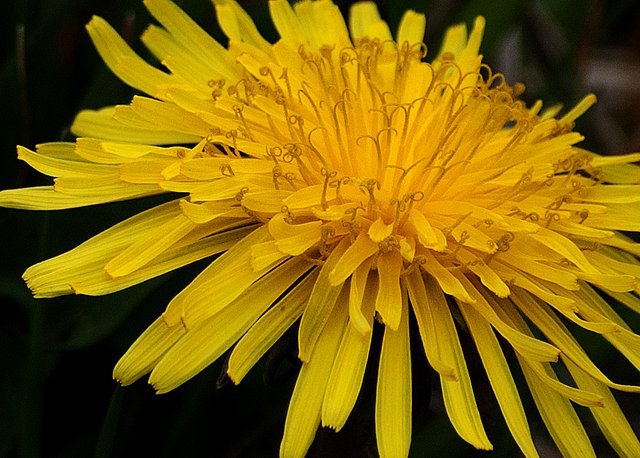
Find the location of a particular element. The image size is (640, 458). light shape in background is located at coordinates (607, 77), (547, 33), (516, 57), (612, 138).